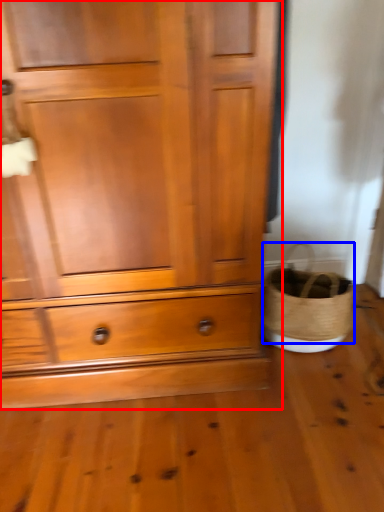
Question: Among these objects, which one is farthest to the camera, chest of drawers (highlighted by a red box) or basket (highlighted by a blue box)?

Choices:
 (A) chest of drawers
 (B) basket

Answer: (B)